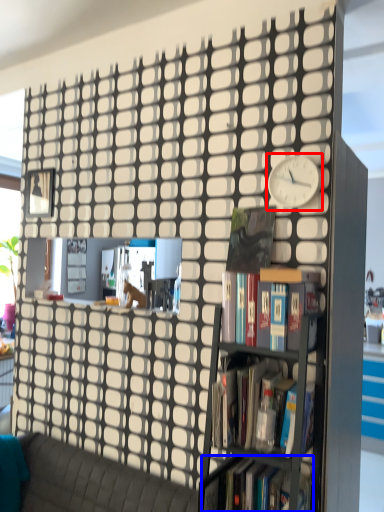
Question: Which object is closer to the camera taking this photo, clock (highlighted by a red box) or book (highlighted by a blue box)?

Choices:
 (A) clock
 (B) book

Answer: (B)